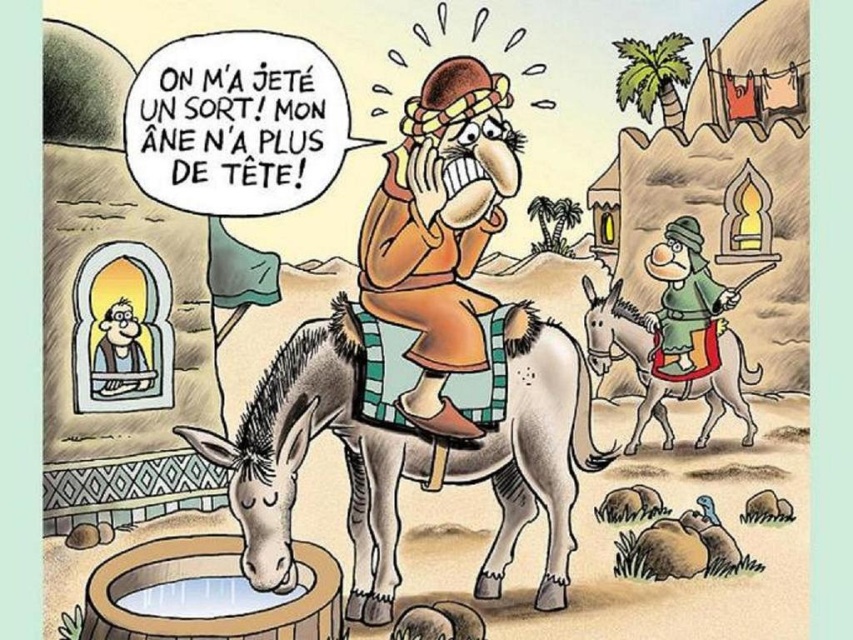
Question: Estimate the real-world distances between objects in this image. Which object is farther from the brown leather hat at upper center?

Choices:
 (A) green fabric hat at upper right
 (B) smooth brown shirt at upper left
 (C) green felt hat at upper right

Answer: (B)

Question: Which point is farther from the camera taking this photo?

Choices:
 (A) (137, 333)
 (B) (381, 484)
 (C) (730, 296)

Answer: (C)

Question: Is gray matte mule at center positioned before green fabric hat at upper right?

Choices:
 (A) no
 (B) yes

Answer: (B)

Question: Considering the real-world distances, which object is closest to the smooth brown shirt at upper left?

Choices:
 (A) gray matte mule at center
 (B) brown leather hat at upper center
 (C) green fabric hat at upper right

Answer: (A)

Question: Is green fabric hat at upper right above smooth brown shirt at upper left?

Choices:
 (A) no
 (B) yes

Answer: (B)

Question: Can you confirm if light blue paper scroll at upper left is smaller than smooth brown shirt at upper left?

Choices:
 (A) no
 (B) yes

Answer: (A)